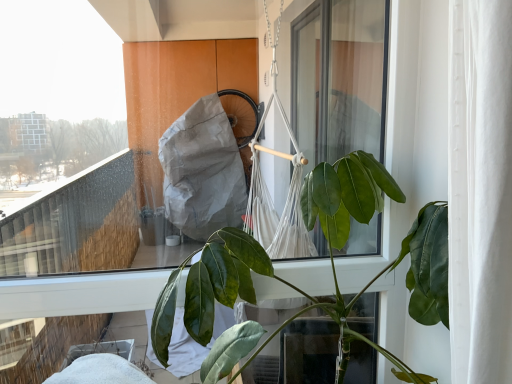
Identify the location of transparent glass window at center. (95, 137).

This screenshot has height=384, width=512. Describe the element at coordinates (95, 137) in the screenshot. I see `transparent glass window at center` at that location.

Find the location of `green glossy leafy plant at center`. green glossy leafy plant at center is located at coordinates (330, 254).

Describe the element at coordinates (330, 254) in the screenshot. I see `green glossy leafy plant at center` at that location.

Where is `transparent glass window at center`? The width and height of the screenshot is (512, 384). transparent glass window at center is located at coordinates point(95,137).

Which is more to the right, green glossy leafy plant at center or transparent glass window at center?

green glossy leafy plant at center.

Is green glossy leafy plant at center in front of or behind transparent glass window at center in the image?

green glossy leafy plant at center is in front of transparent glass window at center.

Considering the points (339, 314) and (158, 253), which point is in front, point (339, 314) or point (158, 253)?

The point (339, 314) is in front.

From the image's perspective, is green glossy leafy plant at center located above or below transparent glass window at center?

green glossy leafy plant at center is below transparent glass window at center.

From a real-world perspective, does green glossy leafy plant at center sit lower than transparent glass window at center?

Yes, from a real-world perspective, green glossy leafy plant at center is under transparent glass window at center.

Considering the sizes of objects green glossy leafy plant at center and transparent glass window at center in the image provided, who is thinner, green glossy leafy plant at center or transparent glass window at center?

With smaller width is transparent glass window at center.

Considering the sizes of green glossy leafy plant at center and transparent glass window at center in the image, is green glossy leafy plant at center taller or shorter than transparent glass window at center?

green glossy leafy plant at center is shorter than transparent glass window at center.

Considering the sizes of objects green glossy leafy plant at center and transparent glass window at center in the image provided, who is bigger, green glossy leafy plant at center or transparent glass window at center?

Bigger between the two is green glossy leafy plant at center.

Can we say green glossy leafy plant at center lies outside transparent glass window at center?

Indeed, green glossy leafy plant at center is completely outside transparent glass window at center.

Is green glossy leafy plant at center not close to transparent glass window at center?

Indeed, green glossy leafy plant at center is not near transparent glass window at center.

In the scene shown: Is green glossy leafy plant at center looking in the opposite direction of transparent glass window at center?

Yes, green glossy leafy plant at center is positioned with its back facing transparent glass window at center.

The width and height of the screenshot is (512, 384). Identify the location of houseplant on the right of transparent glass window at center. (330, 254).

Is transparent glass window at center to the left or to the right of green glossy leafy plant at center in the image?

transparent glass window at center is positioned on green glossy leafy plant at center's left side.

From the picture: Is transparent glass window at center further to camera compared to green glossy leafy plant at center?

Yes, it is behind green glossy leafy plant at center.

Is point (26, 250) farther from viewer compared to point (313, 301)?

That is True.

Based on the photo, from the image's perspective, is transparent glass window at center beneath green glossy leafy plant at center?

No, from the image's perspective, transparent glass window at center is not beneath green glossy leafy plant at center.

From a real-world perspective, is transparent glass window at center positioned over green glossy leafy plant at center based on gravity?

Indeed, from a real-world perspective, transparent glass window at center stands above green glossy leafy plant at center.

Which object is thinner, transparent glass window at center or green glossy leafy plant at center?

transparent glass window at center.

Which of these two, transparent glass window at center or green glossy leafy plant at center, stands taller?

transparent glass window at center.

Between transparent glass window at center and green glossy leafy plant at center, which one has larger size?

green glossy leafy plant at center is bigger.

Can we say transparent glass window at center lies outside green glossy leafy plant at center?

Yes.

Is the surface of transparent glass window at center in direct contact with green glossy leafy plant at center?

No, transparent glass window at center is not beside green glossy leafy plant at center.

Could you tell me if transparent glass window at center is facing green glossy leafy plant at center?

Yes.

How much distance is there between transparent glass window at center and green glossy leafy plant at center?

A distance of 4.44 feet exists between transparent glass window at center and green glossy leafy plant at center.

Find the location of a particular element. window on the left of green glossy leafy plant at center is located at coordinates (95, 137).

You are a GUI agent. You are given a task and a screenshot of the screen. Output one action in this format:
    pyautogui.click(x=<x>, y=<y>)
    Task: Click on the houseplant below the transparent glass window at center (from a real-world perspective)
    
    Given the screenshot: What is the action you would take?
    pyautogui.click(x=330, y=254)

Where is `houseplant located in front of the transparent glass window at center`? This screenshot has height=384, width=512. houseplant located in front of the transparent glass window at center is located at coordinates (330, 254).